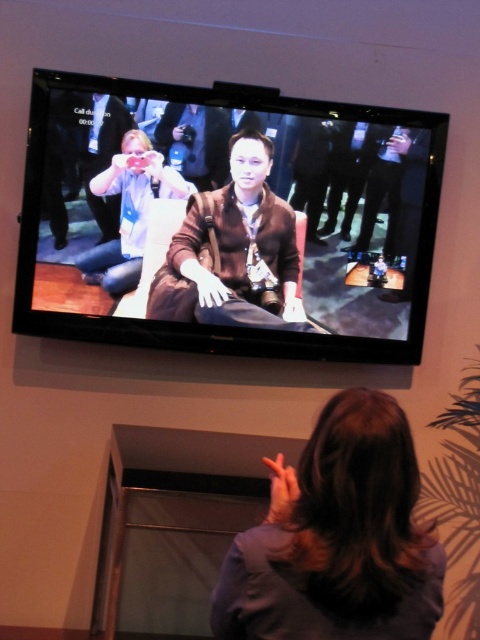
You are trying to locate a specific point in the image. The point is labeled as point (226, 220). Which object is this point located on?

The point (226, 220) is located on the matte black tv at upper center.

You are a delivery person who needs to place a package on the brown leather jacket at center. Can you reach it from your current position?

The brown leather jacket at center is 8.41 feet away from the viewer, so the delivery person cannot reach it from their current position as it is too far.

You are a delivery person who needs to place a 6.5 inch wide package between the matte black tv at upper center and the brown leather jacket at center. Can you fit the package in that space?

The distance between the matte black tv at upper center and the brown leather jacket at center is 5.40 inches, which is narrower than the 6.5 inch wide package. The package cannot fit in that space.